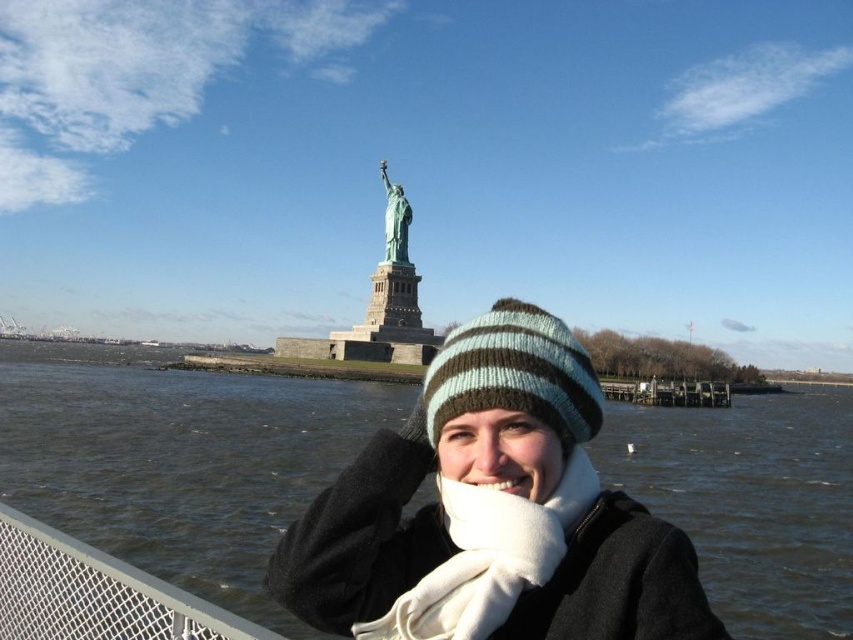
Is dark gray water at lower left to the left of smooth skin nose at center from the viewer's perspective?

Indeed, dark gray water at lower left is positioned on the left side of smooth skin nose at center.

Does point (843, 516) lie in front of point (498, 481)?

No, it is not.

Image resolution: width=853 pixels, height=640 pixels. Identify the location of dark gray water at lower left. (178, 460).

Does point (509, 369) come closer to viewer compared to point (398, 262)?

Yes, point (509, 369) is closer to viewer.

What do you see at coordinates (511, 374) in the screenshot? I see `striped knit beanie at center` at bounding box center [511, 374].

The image size is (853, 640). What are the coordinates of `striped knit beanie at center` in the screenshot? It's located at (511, 374).

Does dark gray water at lower left lie behind green patina statue at center?

That is False.

At what (x,y) coordinates should I click in order to perform the action: click on dark gray water at lower left. Please return your answer as a coordinate pair (x, y). Looking at the image, I should click on (178, 460).